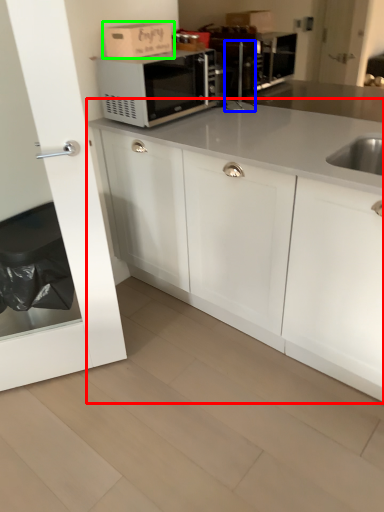
Question: Considering the real-world distances, which object is farthest from cabinetry (highlighted by a red box)? faucet (highlighted by a blue box) or cardboard box (highlighted by a green box)?

Choices:
 (A) faucet
 (B) cardboard box

Answer: (A)